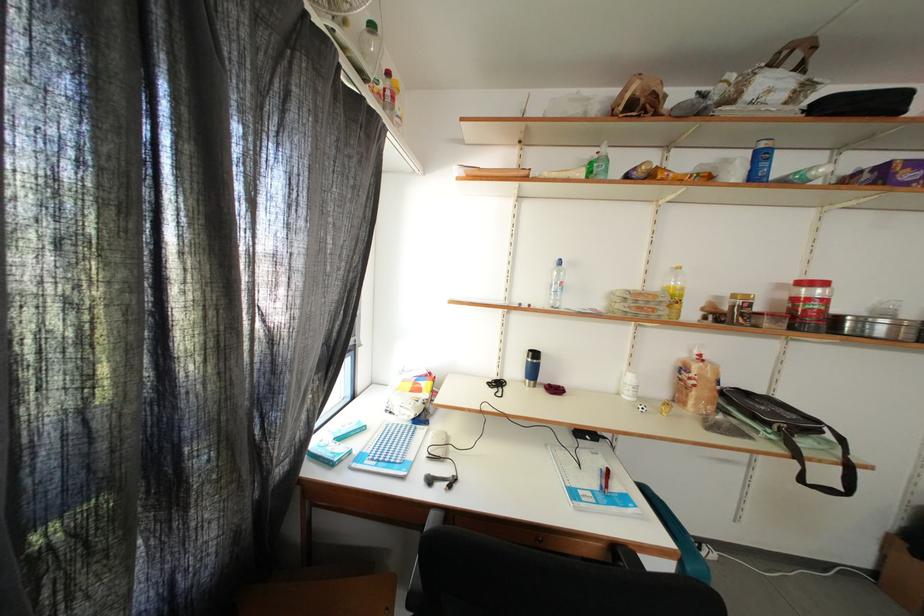
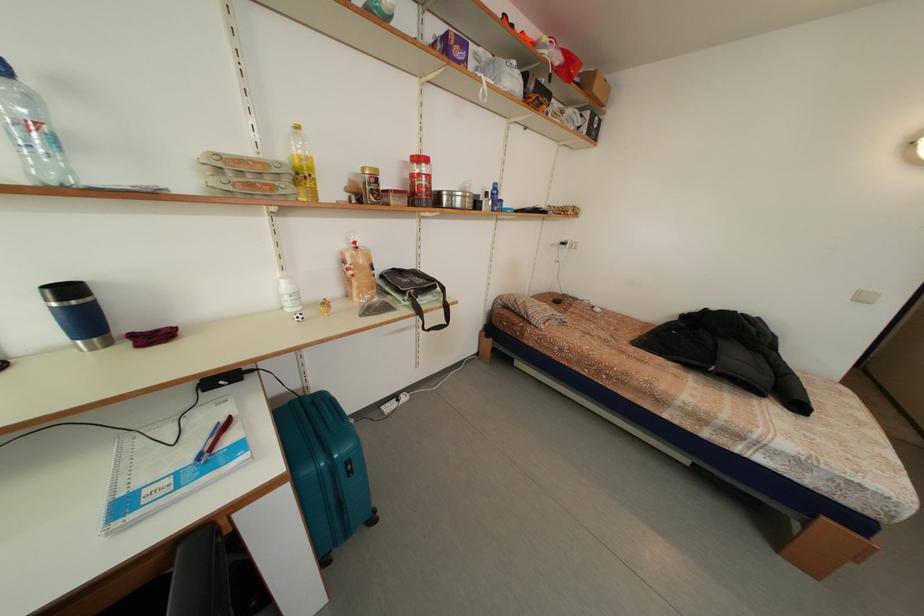
Find the pixel in the second image that matches point 542,360 in the first image.

(78, 296)